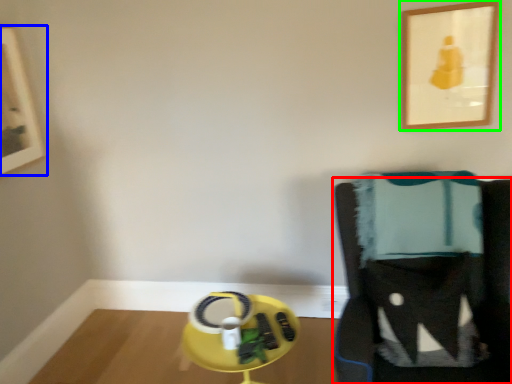
Question: Considering the real-world distances, which object is closest to furniture (highlighted by a red box)? picture frame (highlighted by a blue box) or picture frame (highlighted by a green box).

Choices:
 (A) picture frame
 (B) picture frame

Answer: (B)